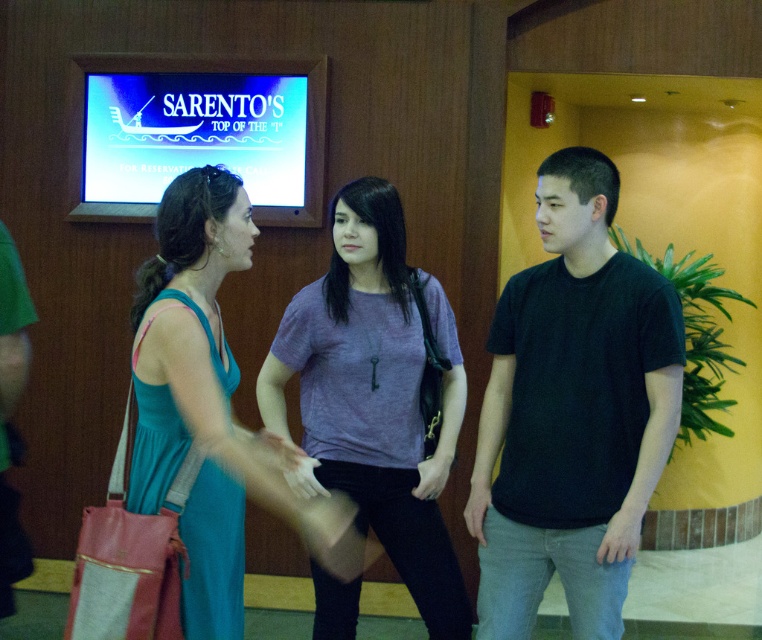
How far apart are black matte t-shirt at center and purple fabric shirt at center?

They are 48.53 centimeters apart.

Locate an element on the screen. The image size is (762, 640). black matte t-shirt at center is located at coordinates (572, 412).

Consider the image. Is purple fabric shirt at center to the left of teal fabric dress at center from the viewer's perspective?

Incorrect, purple fabric shirt at center is not on the left side of teal fabric dress at center.

Can you confirm if purple fabric shirt at center is shorter than teal fabric dress at center?

No, purple fabric shirt at center is not shorter than teal fabric dress at center.

Between point (301, 401) and point (239, 513), which one is positioned in front?

Point (239, 513) is more forward.

You are a GUI agent. You are given a task and a screenshot of the screen. Output one action in this format:
    pyautogui.click(x=<x>, y=<y>)
    Task: Click on the purple fabric shirt at center
    This screenshot has height=640, width=762.
    Given the screenshot: What is the action you would take?
    pyautogui.click(x=373, y=396)

You are a GUI agent. You are given a task and a screenshot of the screen. Output one action in this format:
    pyautogui.click(x=<x>, y=<y>)
    Task: Click on the black matte t-shirt at center
    
    Given the screenshot: What is the action you would take?
    pyautogui.click(x=572, y=412)

Does black matte t-shirt at center appear on the right side of teal fabric dress at center?

Correct, you'll find black matte t-shirt at center to the right of teal fabric dress at center.

What do you see at coordinates (572, 412) in the screenshot?
I see `black matte t-shirt at center` at bounding box center [572, 412].

You are a GUI agent. You are given a task and a screenshot of the screen. Output one action in this format:
    pyautogui.click(x=<x>, y=<y>)
    Task: Click on the black matte t-shirt at center
    
    Given the screenshot: What is the action you would take?
    pyautogui.click(x=572, y=412)